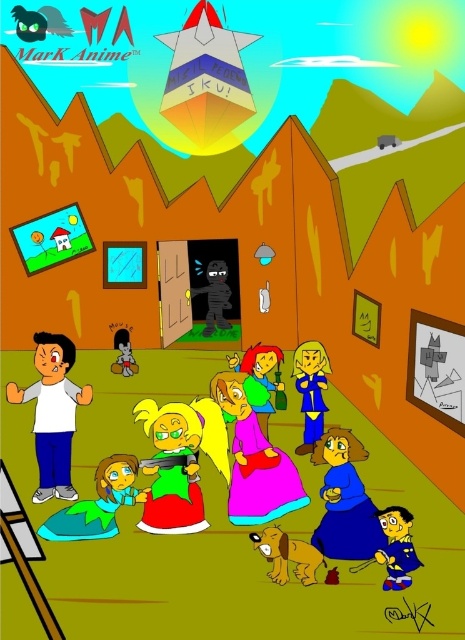
Does blue fabric dress at center have a larger size compared to blue fabric shirt at lower right?

Indeed, blue fabric dress at center has a larger size compared to blue fabric shirt at lower right.

Is point (306, 378) positioned before point (380, 525)?

No, (306, 378) is behind (380, 525).

Find the location of a particular element. Image resolution: width=465 pixels, height=640 pixels. blue fabric dress at center is located at coordinates (311, 388).

Is the position of metallic silver pyramid at center less distant than that of teal fabric dress at lower left?

No, it is behind teal fabric dress at lower left.

Between point (211, 52) and point (54, 531), which one is positioned in front?

Point (54, 531)

Image resolution: width=465 pixels, height=640 pixels. I want to click on metallic silver pyramid at center, so click(205, 77).

Is metallic silver pyramid at center closer to the viewer compared to green fabric dress at center?

No, metallic silver pyramid at center is behind green fabric dress at center.

Who is positioned more to the right, metallic silver pyramid at center or green fabric dress at center?

Positioned to the right is green fabric dress at center.

Does point (177, 83) come in front of point (192, 524)?

No, (177, 83) is further to viewer.

The image size is (465, 640). Find the location of `metallic silver pyramid at center`. metallic silver pyramid at center is located at coordinates (205, 77).